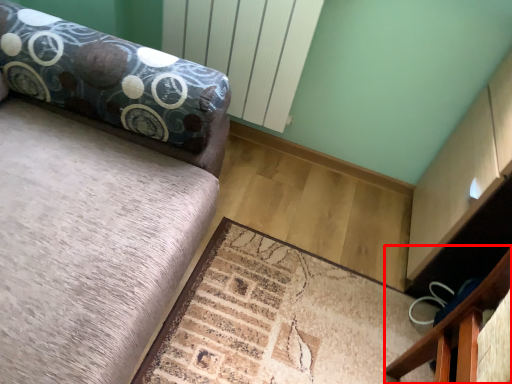
Question: From the image's perspective, considering the relative positions of furniture (annotated by the red box) and mat in the image provided, where is furniture (annotated by the red box) located with respect to the staircase?

Choices:
 (A) below
 (B) above

Answer: (A)